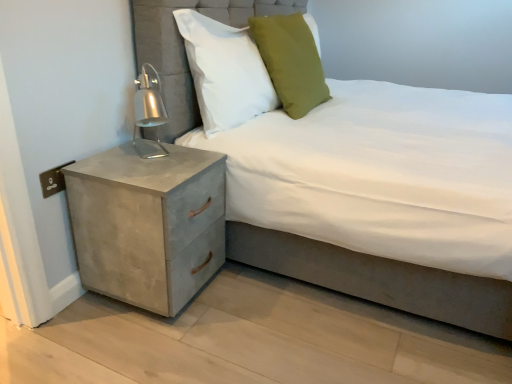
At what (x,y) coordinates should I click in order to perform the action: click on white fabric pillow at upper center, the 1th pillow when ordered from left to right. Please return your answer as a coordinate pair (x, y). Looking at the image, I should click on (225, 72).

Describe the element at coordinates (378, 279) in the screenshot. I see `suede-like gray bed at center` at that location.

Find the location of `suede-like gray bed at center`. suede-like gray bed at center is located at coordinates (378, 279).

At what (x,y) coordinates should I click in order to perform the action: click on concrete textured nightstand at lower left. Please return your answer as a coordinate pair (x, y). Looking at the image, I should click on (147, 224).

You are a GUI agent. You are given a task and a screenshot of the screen. Output one action in this format:
    pyautogui.click(x=<x>, y=<y>)
    Task: Click on the white fabric pillow at upper center, the 1th pillow when ordered from left to right
    
    Given the screenshot: What is the action you would take?
    pyautogui.click(x=225, y=72)

Which is more to the right, suede-like gray bed at center or white fabric pillow at upper center, the 1th pillow when ordered from left to right?

Positioned to the right is suede-like gray bed at center.

From the image's perspective, which pillow is the 1st one above the suede-like gray bed at center? Please provide its 2D coordinates.

[(225, 72)]

Considering the relative sizes of suede-like gray bed at center and white fabric pillow at upper center, which ranks as the second pillow in right-to-left order, in the image provided, is suede-like gray bed at center bigger than white fabric pillow at upper center, which ranks as the second pillow in right-to-left order,?

Indeed, suede-like gray bed at center has a larger size compared to white fabric pillow at upper center, which ranks as the second pillow in right-to-left order.

At what (x,y) coordinates should I click in order to perform the action: click on bed lying on the right of green fabric pillow at upper center, placed as the second pillow when sorted from left to right. Please return your answer as a coordinate pair (x, y). This screenshot has height=384, width=512. Looking at the image, I should click on (378, 279).

Does green fabric pillow at upper center, placed as the second pillow when sorted from left to right, have a larger size compared to suede-like gray bed at center?

Incorrect, green fabric pillow at upper center, placed as the second pillow when sorted from left to right, is not larger than suede-like gray bed at center.

From the image's perspective, which is below, green fabric pillow at upper center, the 1th pillow in the right-to-left sequence, or suede-like gray bed at center?

suede-like gray bed at center is shown below in the image.

Is green fabric pillow at upper center, placed as the second pillow when sorted from left to right, placed right next to suede-like gray bed at center?

No.

Considering the relative sizes of white fabric pillow at upper center, the 1th pillow when ordered from left to right, and green fabric pillow at upper center, the 1th pillow in the right-to-left sequence, in the image provided, is white fabric pillow at upper center, the 1th pillow when ordered from left to right, bigger than green fabric pillow at upper center, the 1th pillow in the right-to-left sequence,?

Incorrect, white fabric pillow at upper center, the 1th pillow when ordered from left to right, is not larger than green fabric pillow at upper center, the 1th pillow in the right-to-left sequence.

Considering the positions of point (217, 73) and point (284, 95), is point (217, 73) closer or farther from the camera than point (284, 95)?

Point (217, 73) appears to be closer to the viewer than point (284, 95).

Considering the relative positions of white fabric pillow at upper center, the 1th pillow when ordered from left to right, and green fabric pillow at upper center, the 1th pillow in the right-to-left sequence, in the image provided, is white fabric pillow at upper center, the 1th pillow when ordered from left to right, to the left of green fabric pillow at upper center, the 1th pillow in the right-to-left sequence, from the viewer's perspective?

Indeed, white fabric pillow at upper center, the 1th pillow when ordered from left to right, is positioned on the left side of green fabric pillow at upper center, the 1th pillow in the right-to-left sequence.

Is white fabric pillow at upper center, which ranks as the second pillow in right-to-left order, shorter than concrete textured nightstand at lower left?

Yes, white fabric pillow at upper center, which ranks as the second pillow in right-to-left order, is shorter than concrete textured nightstand at lower left.

From a real-world perspective, is white fabric pillow at upper center, which ranks as the second pillow in right-to-left order, below concrete textured nightstand at lower left?

No, from a real-world perspective, white fabric pillow at upper center, which ranks as the second pillow in right-to-left order, is not beneath concrete textured nightstand at lower left.

Identify the location of the 2nd pillow directly above the concrete textured nightstand at lower left (from a real-world perspective). The height and width of the screenshot is (384, 512). (225, 72).

Considering the relative sizes of concrete textured nightstand at lower left and green fabric pillow at upper center, the 1th pillow in the right-to-left sequence, in the image provided, is concrete textured nightstand at lower left taller than green fabric pillow at upper center, the 1th pillow in the right-to-left sequence,?

No, concrete textured nightstand at lower left is not taller than green fabric pillow at upper center, the 1th pillow in the right-to-left sequence.

Considering the positions of objects concrete textured nightstand at lower left and green fabric pillow at upper center, placed as the second pillow when sorted from left to right, in the image provided, who is more to the left, concrete textured nightstand at lower left or green fabric pillow at upper center, placed as the second pillow when sorted from left to right,?

From the viewer's perspective, concrete textured nightstand at lower left appears more on the left side.

How many degrees apart are the facing directions of concrete textured nightstand at lower left and green fabric pillow at upper center, placed as the second pillow when sorted from left to right?

They differ by 4.38 degrees in their facing directions.

Is concrete textured nightstand at lower left aimed at green fabric pillow at upper center, placed as the second pillow when sorted from left to right?

No, concrete textured nightstand at lower left is not facing towards green fabric pillow at upper center, placed as the second pillow when sorted from left to right.

Based on the photo, considering the sizes of green fabric pillow at upper center, the 1th pillow in the right-to-left sequence, and concrete textured nightstand at lower left in the image, is green fabric pillow at upper center, the 1th pillow in the right-to-left sequence, taller or shorter than concrete textured nightstand at lower left?

Clearly, green fabric pillow at upper center, the 1th pillow in the right-to-left sequence, is taller compared to concrete textured nightstand at lower left.

Identify the location of nightstand lying in front of the green fabric pillow at upper center, placed as the second pillow when sorted from left to right. (147, 224).

From a real-world perspective, which object rests below the other?

In real-world perspective, concrete textured nightstand at lower left is lower.

Between green fabric pillow at upper center, placed as the second pillow when sorted from left to right, and concrete textured nightstand at lower left, which one has smaller width?

Thinner between the two is green fabric pillow at upper center, placed as the second pillow when sorted from left to right.

Considering the sizes of objects concrete textured nightstand at lower left and white fabric pillow at upper center, the 1th pillow when ordered from left to right, in the image provided, who is taller, concrete textured nightstand at lower left or white fabric pillow at upper center, the 1th pillow when ordered from left to right,?

concrete textured nightstand at lower left.

Is concrete textured nightstand at lower left facing towards white fabric pillow at upper center, the 1th pillow when ordered from left to right?

No, concrete textured nightstand at lower left does not turn towards white fabric pillow at upper center, the 1th pillow when ordered from left to right.

From the image's perspective, is concrete textured nightstand at lower left on top of white fabric pillow at upper center, the 1th pillow when ordered from left to right?

No, from the image's perspective, concrete textured nightstand at lower left is not above white fabric pillow at upper center, the 1th pillow when ordered from left to right.

I want to click on nightstand below the white fabric pillow at upper center, the 1th pillow when ordered from left to right (from a real-world perspective), so click(x=147, y=224).

In order to click on pillow that is the 2nd object above the suede-like gray bed at center (from a real-world perspective) in this screenshot , I will do click(x=225, y=72).

I want to click on the 2nd pillow above when counting from the suede-like gray bed at center (from the image's perspective), so click(x=291, y=61).

Based on their spatial positions, is concrete textured nightstand at lower left or suede-like gray bed at center further from green fabric pillow at upper center, the 1th pillow in the right-to-left sequence?

Based on the image, suede-like gray bed at center appears to be further to green fabric pillow at upper center, the 1th pillow in the right-to-left sequence.

Looking at the image, which one is located further to white fabric pillow at upper center, which ranks as the second pillow in right-to-left order, suede-like gray bed at center or concrete textured nightstand at lower left?

suede-like gray bed at center is positioned further to the anchor white fabric pillow at upper center, which ranks as the second pillow in right-to-left order.

When comparing their distances from suede-like gray bed at center, does white fabric pillow at upper center, the 1th pillow when ordered from left to right, or green fabric pillow at upper center, the 1th pillow in the right-to-left sequence, seem further?

The object further to suede-like gray bed at center is green fabric pillow at upper center, the 1th pillow in the right-to-left sequence.

Based on their spatial positions, is green fabric pillow at upper center, placed as the second pillow when sorted from left to right, or white fabric pillow at upper center, which ranks as the second pillow in right-to-left order, closer to suede-like gray bed at center?

white fabric pillow at upper center, which ranks as the second pillow in right-to-left order, is closer to suede-like gray bed at center.

Based on the photo, from the image, which object appears to be farther from white fabric pillow at upper center, the 1th pillow when ordered from left to right, green fabric pillow at upper center, the 1th pillow in the right-to-left sequence, or concrete textured nightstand at lower left?

concrete textured nightstand at lower left.

Considering their positions, is green fabric pillow at upper center, the 1th pillow in the right-to-left sequence, positioned closer to suede-like gray bed at center than concrete textured nightstand at lower left?

concrete textured nightstand at lower left is positioned closer to the anchor suede-like gray bed at center.

Based on their spatial positions, is white fabric pillow at upper center, the 1th pillow when ordered from left to right, or green fabric pillow at upper center, the 1th pillow in the right-to-left sequence, closer to concrete textured nightstand at lower left?

Based on the image, white fabric pillow at upper center, the 1th pillow when ordered from left to right, appears to be nearer to concrete textured nightstand at lower left.

Looking at the image, which one is located further to concrete textured nightstand at lower left, green fabric pillow at upper center, placed as the second pillow when sorted from left to right, or suede-like gray bed at center?

green fabric pillow at upper center, placed as the second pillow when sorted from left to right, is further to concrete textured nightstand at lower left.

Locate an element on the screen. The height and width of the screenshot is (384, 512). pillow between green fabric pillow at upper center, the 1th pillow in the right-to-left sequence, and concrete textured nightstand at lower left from top to bottom is located at coordinates (225, 72).

The height and width of the screenshot is (384, 512). Identify the location of nightstand between suede-like gray bed at center and green fabric pillow at upper center, the 1th pillow in the right-to-left sequence, along the z-axis. (147, 224).

Where is `pillow between suede-like gray bed at center and green fabric pillow at upper center, placed as the second pillow when sorted from left to right, along the z-axis`? The width and height of the screenshot is (512, 384). pillow between suede-like gray bed at center and green fabric pillow at upper center, placed as the second pillow when sorted from left to right, along the z-axis is located at coordinates (225, 72).